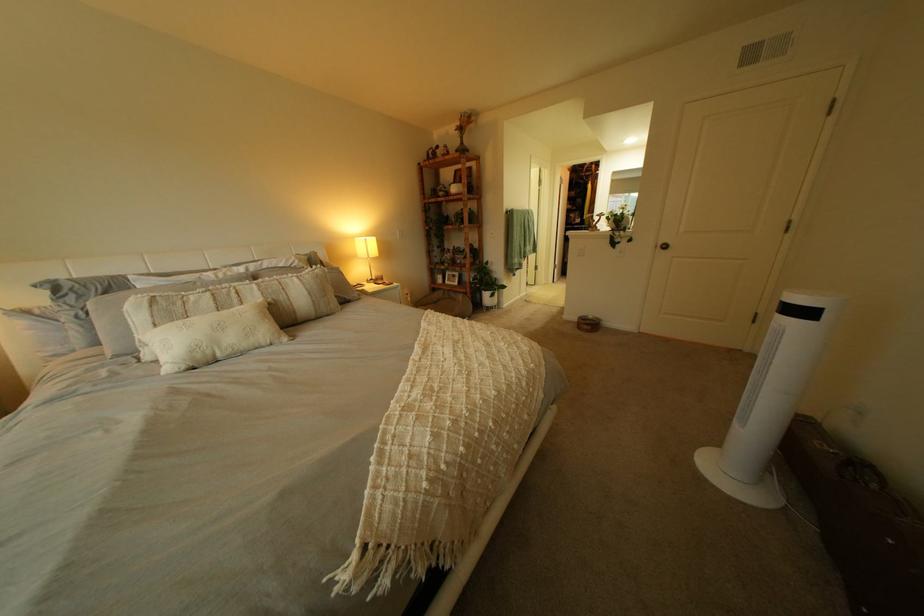
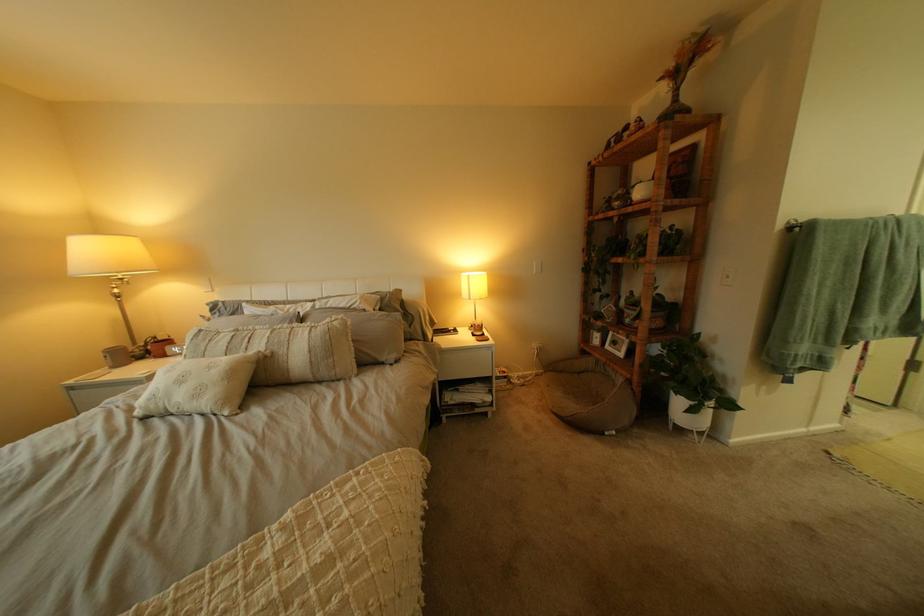
Where in the second image is the point corresponding to [470,131] from the first image?

(675, 81)